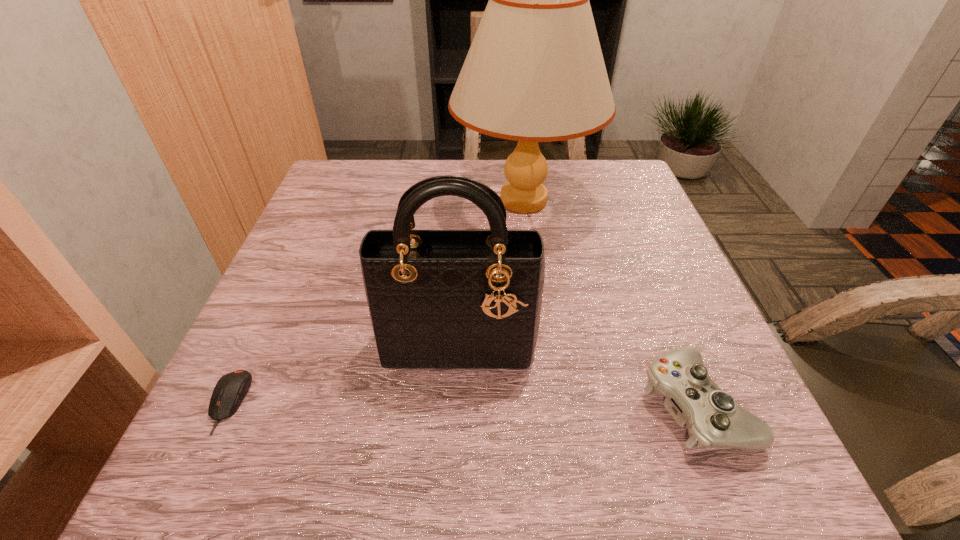
Locate an element on the screen. vacant space that is in between the handbag and the shortest object is located at coordinates (344, 373).

Identify the location of free space between the computer mouse and the third shortest object. The height and width of the screenshot is (540, 960). (344, 373).

Locate an element on the screen. The width and height of the screenshot is (960, 540). object that ranks as the third closest to the handbag is located at coordinates (535, 72).

I want to click on object identified as the second closest to the lampshade, so click(x=713, y=419).

Where is `vacant area that satisfies the following two spatial constraints: 1. at the front of the third tallest object with visible charms; 2. on the left side of the second tallest object`? This screenshot has width=960, height=540. vacant area that satisfies the following two spatial constraints: 1. at the front of the third tallest object with visible charms; 2. on the left side of the second tallest object is located at coordinates (455, 404).